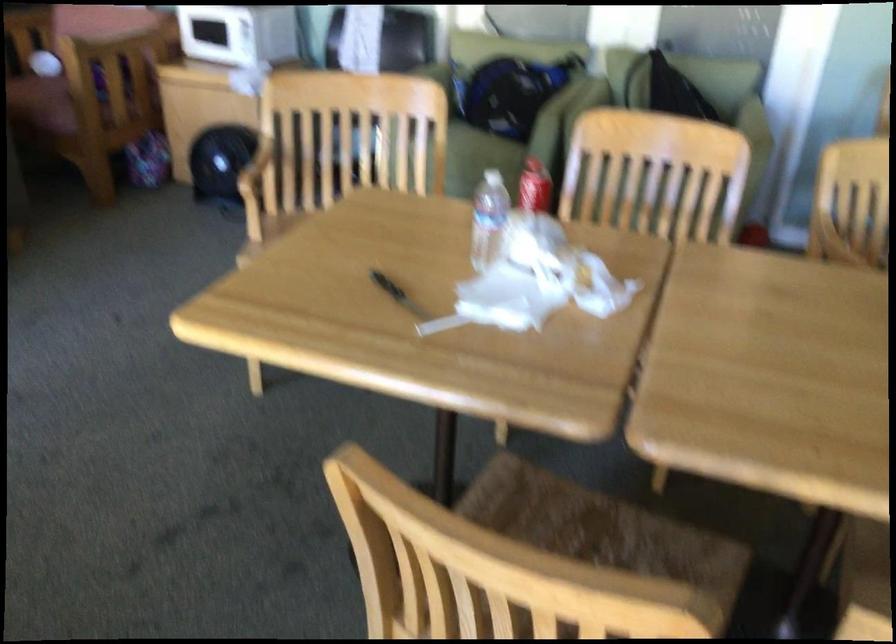
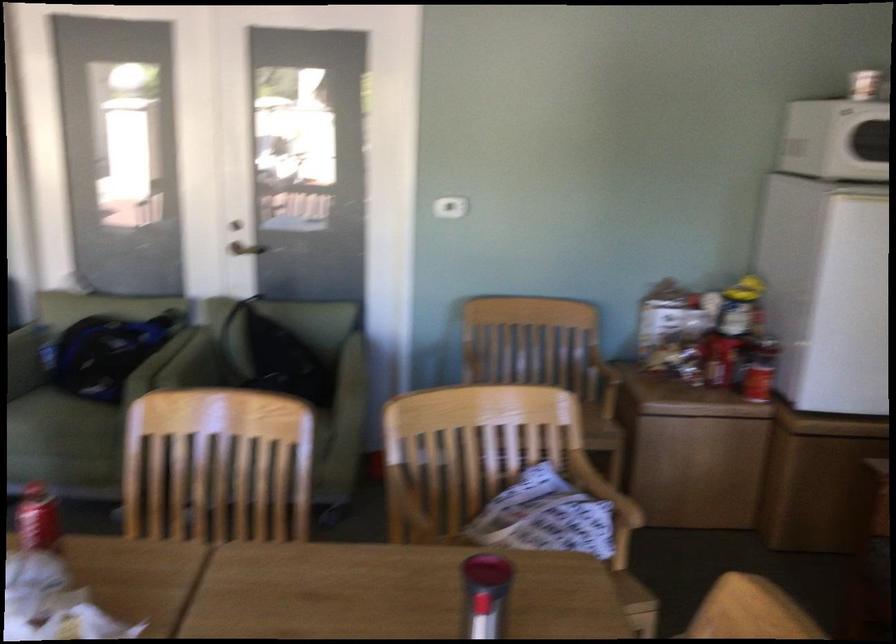
Question: Based on the continuous images, in which direction is the camera rotating? Reply with the corresponding letter.

Choices:
 (A) Left
 (B) Right
 (C) Up
 (D) Down

Answer: (B)